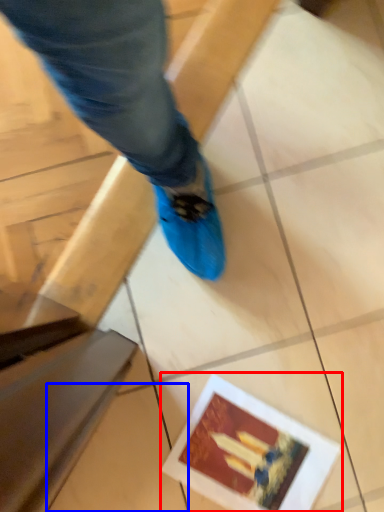
Question: Which object appears closest to the camera in this image, postcard (highlighted by a red box) or tile (highlighted by a blue box)?

Choices:
 (A) postcard
 (B) tile

Answer: (B)